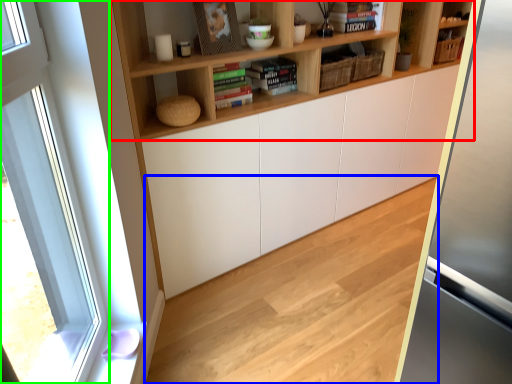
Question: Estimate the real-world distances between objects in this image. Which object is closer to shelf (highlighted by a red box), hardwood (highlighted by a blue box) or window (highlighted by a green box)?

Choices:
 (A) hardwood
 (B) window

Answer: (B)